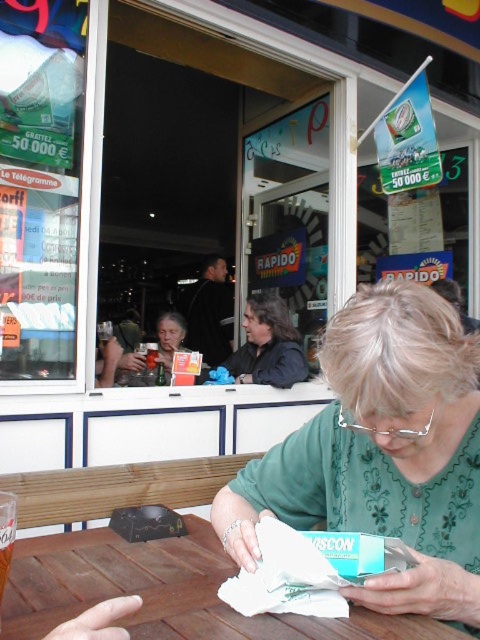
In the scene shown: Who is positioned more to the right, dark brown leather jacket at center or matte plastic cup at upper left?

dark brown leather jacket at center

Who is higher up, dark brown leather jacket at center or matte plastic cup at upper left?

Positioned higher is matte plastic cup at upper left.

Which is in front, point (274, 339) or point (144, 360)?

Positioned in front is point (144, 360).

Where is `dark brown leather jacket at center`? Image resolution: width=480 pixels, height=640 pixels. dark brown leather jacket at center is located at coordinates (267, 346).

Is green fabric shirt at center positioned in front of matte plastic cup at upper left?

Yes, green fabric shirt at center is in front of matte plastic cup at upper left.

Looking at this image, can you confirm if green fabric shirt at center is bigger than matte plastic cup at upper left?

No.

Where is `green fabric shirt at center`? green fabric shirt at center is located at coordinates click(383, 452).

Between point (436, 600) and point (214, 560), which one is positioned behind?

The point (214, 560) is more distant.

Is green fabric shirt at center shorter than brown wooden table at lower left?

No, green fabric shirt at center is not shorter than brown wooden table at lower left.

What do you see at coordinates (383, 452) in the screenshot? This screenshot has width=480, height=640. I see `green fabric shirt at center` at bounding box center [383, 452].

I want to click on green fabric shirt at center, so click(x=383, y=452).